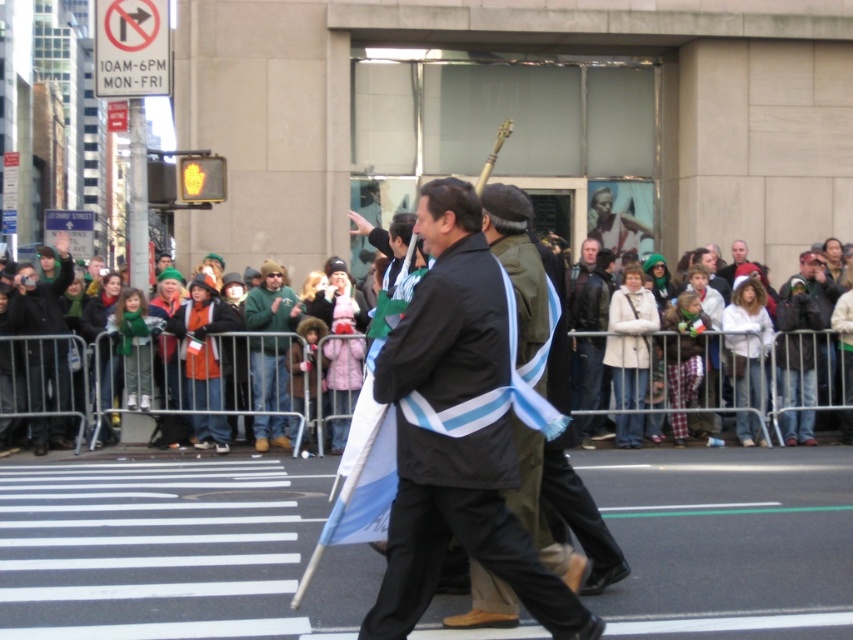
Question: Which object appears closest to the camera in this image?

Choices:
 (A) multicolored fabric at center
 (B) light brown leather jacket at center
 (C) green fleece jacket at center

Answer: (C)

Question: From the image, what is the correct spatial relationship of matte black jacket at left in relation to green fleece jacket at center?

Choices:
 (A) left
 (B) right

Answer: (A)

Question: Does green fleece jacket at center come in front of light brown leather jacket at center?

Choices:
 (A) no
 (B) yes

Answer: (B)

Question: Can you confirm if green fleece jacket at center is smaller than light brown leather jacket at center?

Choices:
 (A) no
 (B) yes

Answer: (A)

Question: Which of the following is the closest to the observer?

Choices:
 (A) (733, 252)
 (B) (228, 385)
 (C) (529, 534)
 (D) (44, 438)

Answer: (C)

Question: Estimate the real-world distances between objects in this image. Which object is farther from the green fleece jacket at center?

Choices:
 (A) matte black jacket at left
 (B) multicolored fabric at center

Answer: (A)